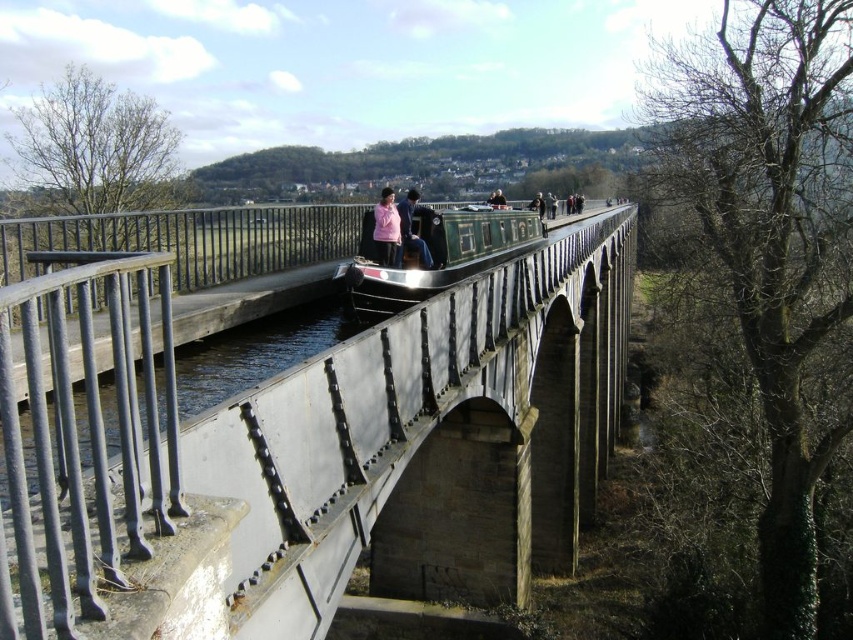
You are a photographer positioned on the aqueduct and want to capture both the green polished wood boat at center and the matte pink jacket at center in a single shot. Which object will appear larger in the photo?

The green polished wood boat at center will appear larger in the photo because it is closer to the viewer than the matte pink jacket at center.

You are a passenger on the canal boat and want to take a photo of the smooth concrete bridge at center without any people in the frame. Since the matte pink jacket at center is blocking your view, can you look above or below it to capture the bridge?

The smooth concrete bridge at center is below the matte pink jacket at center, so you can look below the matte pink jacket at center to capture the bridge without the obstruction.

Consider the image. You are a photographer standing at the edge of the canal, aiming to capture a closeup shot of the smooth concrete bridge at center. Your camera has a minimum focusing distance of 5 meters. Can you take the photo without moving closer?

The smooth concrete bridge at center is 6.91 meters away from the camera. Since the minimum focusing distance is 5 meters, the photographer can take the photo without moving closer because the bridge is beyond the minimum required distance.